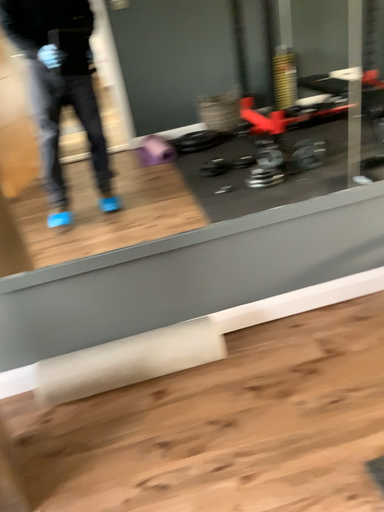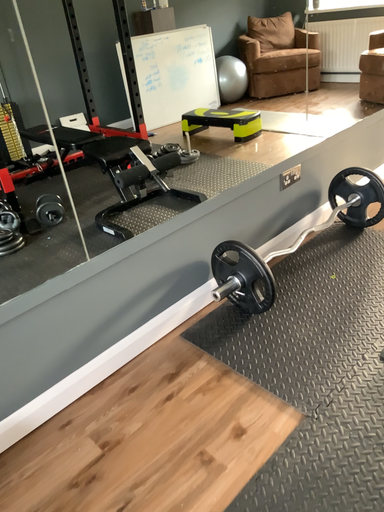
Question: How did the camera likely rotate when shooting the video?

Choices:
 (A) rotated left
 (B) rotated right

Answer: (B)